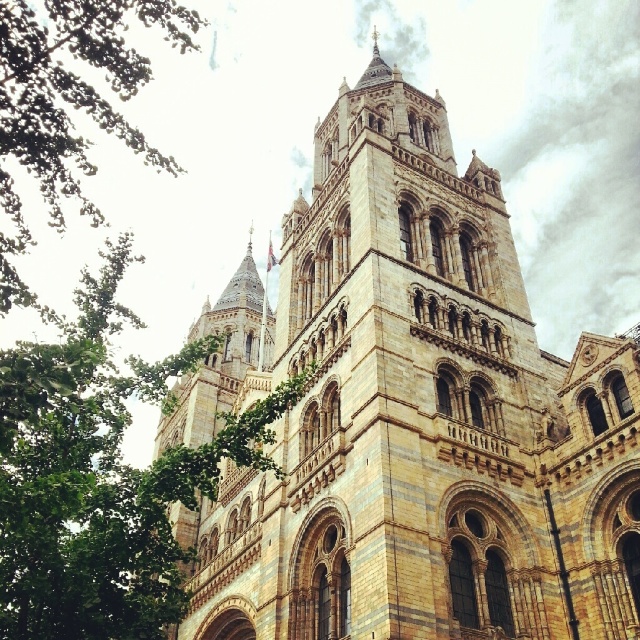
Can you confirm if brown stone church at center is positioned to the left of green leafy tree at upper left?

In fact, brown stone church at center is to the right of green leafy tree at upper left.

Who is lower down, brown stone church at center or green leafy tree at upper left?

brown stone church at center is lower down.

Between point (536, 636) and point (77, 100), which one is positioned behind?

The point (536, 636) is behind.

Locate an element on the screen. The height and width of the screenshot is (640, 640). brown stone church at center is located at coordinates (408, 413).

From the picture: Is green leafy tree at left positioned in front of green leafy tree at upper left?

Yes, green leafy tree at left is in front of green leafy tree at upper left.

Can you confirm if green leafy tree at left is taller than green leafy tree at upper left?

No, green leafy tree at left is not taller than green leafy tree at upper left.

Is point (93, 625) positioned before point (74, 93)?

Yes, it is in front of point (74, 93).

Locate an element on the screen. The width and height of the screenshot is (640, 640). green leafy tree at left is located at coordinates (100, 476).

Does brown stone church at center appear on the left side of green leafy tree at left?

Incorrect, brown stone church at center is not on the left side of green leafy tree at left.

Measure the distance between brown stone church at center and camera.

brown stone church at center is 39.55 meters from camera.

You are a GUI agent. You are given a task and a screenshot of the screen. Output one action in this format:
    pyautogui.click(x=<x>, y=<y>)
    Task: Click on the brown stone church at center
    The image size is (640, 640).
    Given the screenshot: What is the action you would take?
    pyautogui.click(x=408, y=413)